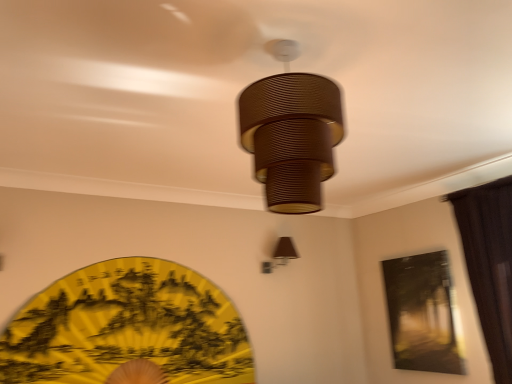
What do you see at coordinates (489, 264) in the screenshot?
I see `brown fabric curtain at right` at bounding box center [489, 264].

Measure the distance between brown ribbed lampshade at center, acting as the second lamp starting from the bottom, and camera.

brown ribbed lampshade at center, acting as the second lamp starting from the bottom, is 3.74 feet away from camera.

This screenshot has height=384, width=512. Identify the location of yellow paper fan at lower left. (127, 329).

At what (x,y) coordinates should I click in order to perform the action: click on matte black painting at upper right. Please return your answer as a coordinate pair (x, y). Image resolution: width=512 pixels, height=384 pixels. Looking at the image, I should click on (421, 313).

You are a GUI agent. You are given a task and a screenshot of the screen. Output one action in this format:
    pyautogui.click(x=<x>, y=<y>)
    Task: Click on the brown fabric curtain at right
    This screenshot has width=512, height=384.
    Given the screenshot: What is the action you would take?
    pyautogui.click(x=489, y=264)

From a real-world perspective, is yellow paper fan at lower left physically located above or below brown fabric lampshade at upper right, the 1th lamp positioned from the back?

yellow paper fan at lower left is below brown fabric lampshade at upper right, the 1th lamp positioned from the back.

Can we say yellow paper fan at lower left lies outside brown fabric lampshade at upper right, the 1th lamp positioned from the back?

Indeed, yellow paper fan at lower left is completely outside brown fabric lampshade at upper right, the 1th lamp positioned from the back.

Is yellow paper fan at lower left oriented away from brown fabric lampshade at upper right, which appears as the first lamp when ordered from the bottom?

No.

Is yellow paper fan at lower left directly adjacent to brown fabric lampshade at upper right, which ranks as the second lamp in top-to-bottom order?

No, yellow paper fan at lower left is not with brown fabric lampshade at upper right, which ranks as the second lamp in top-to-bottom order.

In the scene shown: Considering the positions of objects brown fabric lampshade at upper right, which ranks as the second lamp in top-to-bottom order, and brown fabric curtain at right in the image provided, who is more to the left, brown fabric lampshade at upper right, which ranks as the second lamp in top-to-bottom order, or brown fabric curtain at right?

From the viewer's perspective, brown fabric lampshade at upper right, which ranks as the second lamp in top-to-bottom order, appears more on the left side.

Between brown fabric lampshade at upper right, the 1th lamp positioned from the back, and brown fabric curtain at right, which one has less height?

brown fabric lampshade at upper right, the 1th lamp positioned from the back, is shorter.

Is brown fabric lampshade at upper right, which appears as the first lamp when ordered from the bottom, thinner than brown fabric curtain at right?

No.

Is point (280, 265) behind point (484, 245)?

Yes, point (280, 265) is behind point (484, 245).

From a real-world perspective, between matte black painting at upper right and brown ribbed lampshade at center, placed as the first lamp when sorted from top to bottom, who is vertically higher?

brown ribbed lampshade at center, placed as the first lamp when sorted from top to bottom, is physically above.

From the image's perspective, count 2nd lamps upward from the matte black painting at upper right and point to it. Please provide its 2D coordinates.

[(292, 137)]

From the image's perspective, which is below, matte black painting at upper right or brown ribbed lampshade at center, placed as the first lamp when sorted from top to bottom?

matte black painting at upper right.

Which point is more distant from viewer, [424,343] or [331,174]?

The point [424,343] is more distant.

Is brown ribbed lampshade at center, marked as the second lamp in a back-to-front arrangement, to the right of brown fabric lampshade at upper right, arranged as the second lamp when viewed from the front, from the viewer's perspective?

No.

Which object is thinner, brown ribbed lampshade at center, placed as the first lamp when sorted from top to bottom, or brown fabric lampshade at upper right, which appears as the first lamp when ordered from the bottom?

With smaller width is brown fabric lampshade at upper right, which appears as the first lamp when ordered from the bottom.

From a real-world perspective, is brown ribbed lampshade at center, marked as the second lamp in a back-to-front arrangement, positioned above or below brown fabric lampshade at upper right, which appears as the first lamp when ordered from the bottom?

brown ribbed lampshade at center, marked as the second lamp in a back-to-front arrangement, is above brown fabric lampshade at upper right, which appears as the first lamp when ordered from the bottom.

In the image, is brown fabric lampshade at upper right, the 1th lamp positioned from the back, on the left side or the right side of matte black painting at upper right?

brown fabric lampshade at upper right, the 1th lamp positioned from the back, is positioned on matte black painting at upper right's left side.

Looking at their sizes, would you say brown fabric lampshade at upper right, which ranks as the second lamp in top-to-bottom order, is wider or thinner than matte black painting at upper right?

Considering their sizes, brown fabric lampshade at upper right, which ranks as the second lamp in top-to-bottom order, looks broader than matte black painting at upper right.

From a real-world perspective, is brown fabric lampshade at upper right, which appears as the first lamp when ordered from the bottom, located higher than matte black painting at upper right?

Yes, from a real-world perspective, brown fabric lampshade at upper right, which appears as the first lamp when ordered from the bottom, is above matte black painting at upper right.

In terms of height, does brown fabric lampshade at upper right, the 1th lamp positioned from the back, look taller or shorter compared to matte black painting at upper right?

brown fabric lampshade at upper right, the 1th lamp positioned from the back, is shorter than matte black painting at upper right.

Considering the positions of points (407, 275) and (267, 268), is point (407, 275) farther from camera compared to point (267, 268)?

That is False.

Who is smaller, matte black painting at upper right or brown fabric lampshade at upper right, which ranks as the second lamp in top-to-bottom order?

brown fabric lampshade at upper right, which ranks as the second lamp in top-to-bottom order.

Does matte black painting at upper right appear on the right side of brown fabric lampshade at upper right, which appears as the first lamp when ordered from the bottom?

Indeed, matte black painting at upper right is positioned on the right side of brown fabric lampshade at upper right, which appears as the first lamp when ordered from the bottom.

Which object is wider, matte black painting at upper right or brown fabric lampshade at upper right, arranged as the second lamp when viewed from the front?

Wider between the two is brown fabric lampshade at upper right, arranged as the second lamp when viewed from the front.

Would you say yellow paper fan at lower left is to the left or to the right of matte black painting at upper right in the picture?

yellow paper fan at lower left is positioned on matte black painting at upper right's left side.

Which of these two, yellow paper fan at lower left or matte black painting at upper right, is thinner?

matte black painting at upper right is thinner.

Where is `window screen that appears below the yellow paper fan at lower left (from the image's perspective)`? window screen that appears below the yellow paper fan at lower left (from the image's perspective) is located at coordinates (421, 313).

Measure the distance between yellow paper fan at lower left and matte black painting at upper right.

yellow paper fan at lower left is 5.17 feet from matte black painting at upper right.

You are a GUI agent. You are given a task and a screenshot of the screen. Output one action in this format:
    pyautogui.click(x=<x>, y=<y>)
    Task: Click on the 2nd lamp to the right when counting from the yellow paper fan at lower left
    This screenshot has width=512, height=384.
    Given the screenshot: What is the action you would take?
    pyautogui.click(x=280, y=254)

Starting from the brown fabric curtain at right, which lamp is the 1st one to the left? Please provide its 2D coordinates.

[(280, 254)]

Based on their spatial positions, is brown ribbed lampshade at center, marked as the second lamp in a back-to-front arrangement, or yellow paper fan at lower left closer to brown fabric curtain at right?

brown ribbed lampshade at center, marked as the second lamp in a back-to-front arrangement, lies closer to brown fabric curtain at right than the other object.

Which object lies further to the anchor point brown fabric curtain at right, brown ribbed lampshade at center, marked as the second lamp in a back-to-front arrangement, or brown fabric lampshade at upper right, which ranks as the second lamp in top-to-bottom order?

brown ribbed lampshade at center, marked as the second lamp in a back-to-front arrangement.

When comparing their distances from brown ribbed lampshade at center, the 1th lamp when ordered from front to back, does yellow paper fan at lower left or brown fabric lampshade at upper right, arranged as the second lamp when viewed from the front, seem further?

Based on the image, brown fabric lampshade at upper right, arranged as the second lamp when viewed from the front, appears to be further to brown ribbed lampshade at center, the 1th lamp when ordered from front to back.

Considering their positions, is brown fabric lampshade at upper right, the 1th lamp positioned from the back, positioned closer to yellow paper fan at lower left than brown ribbed lampshade at center, the 1th lamp when ordered from front to back?

brown fabric lampshade at upper right, the 1th lamp positioned from the back.

From the image, which object appears to be nearer to brown fabric lampshade at upper right, arranged as the second lamp when viewed from the front, brown ribbed lampshade at center, marked as the second lamp in a back-to-front arrangement, or matte black painting at upper right?

Among the two, matte black painting at upper right is located nearer to brown fabric lampshade at upper right, arranged as the second lamp when viewed from the front.

From the image, which object appears to be farther from brown ribbed lampshade at center, the 1th lamp when ordered from front to back, brown fabric lampshade at upper right, the 1th lamp positioned from the back, or matte black painting at upper right?

matte black painting at upper right is positioned further to the anchor brown ribbed lampshade at center, the 1th lamp when ordered from front to back.

Based on their spatial positions, is brown fabric lampshade at upper right, which appears as the first lamp when ordered from the bottom, or brown fabric curtain at right closer to brown ribbed lampshade at center, placed as the first lamp when sorted from top to bottom?

Among the two, brown fabric curtain at right is located nearer to brown ribbed lampshade at center, placed as the first lamp when sorted from top to bottom.

Which object lies nearer to the anchor point yellow paper fan at lower left, matte black painting at upper right or brown fabric lampshade at upper right, arranged as the second lamp when viewed from the front?

brown fabric lampshade at upper right, arranged as the second lamp when viewed from the front, lies closer to yellow paper fan at lower left than the other object.

You are a GUI agent. You are given a task and a screenshot of the screen. Output one action in this format:
    pyautogui.click(x=<x>, y=<y>)
    Task: Click on the curtain located between brown ribbed lampshade at center, marked as the second lamp in a back-to-front arrangement, and brown fabric lampshade at upper right, arranged as the second lamp when viewed from the front, in the depth direction
    The height and width of the screenshot is (384, 512).
    Given the screenshot: What is the action you would take?
    pyautogui.click(x=489, y=264)

Where is `design between brown ribbed lampshade at center, placed as the first lamp when sorted from top to bottom, and brown fabric lampshade at upper right, which ranks as the second lamp in top-to-bottom order, along the z-axis`? design between brown ribbed lampshade at center, placed as the first lamp when sorted from top to bottom, and brown fabric lampshade at upper right, which ranks as the second lamp in top-to-bottom order, along the z-axis is located at coordinates (127, 329).

This screenshot has height=384, width=512. Find the location of `window screen located between brown fabric lampshade at upper right, which ranks as the second lamp in top-to-bottom order, and brown fabric curtain at right in the left-right direction`. window screen located between brown fabric lampshade at upper right, which ranks as the second lamp in top-to-bottom order, and brown fabric curtain at right in the left-right direction is located at coordinates (421, 313).

Identify the location of curtain between brown ribbed lampshade at center, the 1th lamp when ordered from front to back, and matte black painting at upper right in the front-back direction. (489, 264).